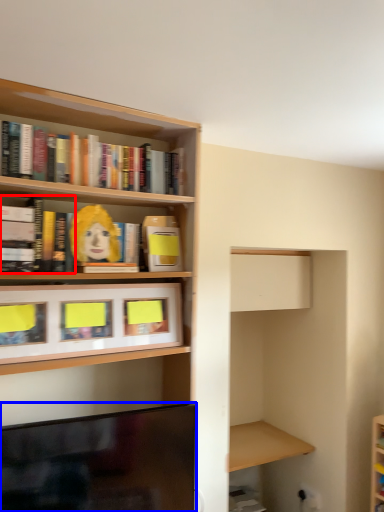
Question: Which of the following is the farthest to the observer, book (highlighted by a red box) or television (highlighted by a blue box)?

Choices:
 (A) book
 (B) television

Answer: (A)